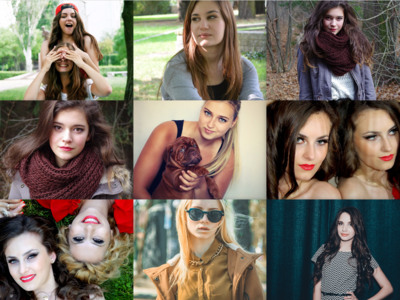
Find the location of a particular element. photos in the grid is located at coordinates (85, 72), (227, 73), (314, 69), (331, 152), (187, 153), (100, 153), (80, 250), (234, 260), (378, 268).